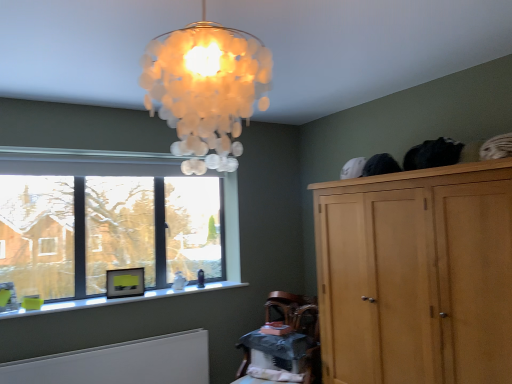
Question: Does wooden table at lower center have a lesser height compared to clear glass window at lower left?

Choices:
 (A) yes
 (B) no

Answer: (A)

Question: Does wooden table at lower center lie behind clear glass window at lower left?

Choices:
 (A) no
 (B) yes

Answer: (A)

Question: Is wooden table at lower center bigger than clear glass window at lower left?

Choices:
 (A) no
 (B) yes

Answer: (A)

Question: Considering the relative sizes of wooden table at lower center and clear glass window at lower left in the image provided, is wooden table at lower center smaller than clear glass window at lower left?

Choices:
 (A) yes
 (B) no

Answer: (A)

Question: Does wooden table at lower center have a greater width compared to clear glass window at lower left?

Choices:
 (A) no
 (B) yes

Answer: (B)

Question: Is wooden table at lower center closer to camera compared to clear glass window at lower left?

Choices:
 (A) no
 (B) yes

Answer: (B)

Question: Is wooden armchair at lower center positioned behind clear glass window at lower left?

Choices:
 (A) yes
 (B) no

Answer: (A)

Question: Is wooden armchair at lower center aimed at clear glass window at lower left?

Choices:
 (A) no
 (B) yes

Answer: (A)

Question: Can you confirm if wooden armchair at lower center is wider than clear glass window at lower left?

Choices:
 (A) no
 (B) yes

Answer: (B)

Question: From a real-world perspective, does wooden armchair at lower center stand above clear glass window at lower left?

Choices:
 (A) yes
 (B) no

Answer: (B)

Question: Is wooden armchair at lower center far away from clear glass window at lower left?

Choices:
 (A) yes
 (B) no

Answer: (A)

Question: Does wooden armchair at lower center have a greater height compared to clear glass window at lower left?

Choices:
 (A) yes
 (B) no

Answer: (B)

Question: Does clear glass window at lower left appear on the left side of wooden armchair at lower center?

Choices:
 (A) yes
 (B) no

Answer: (A)